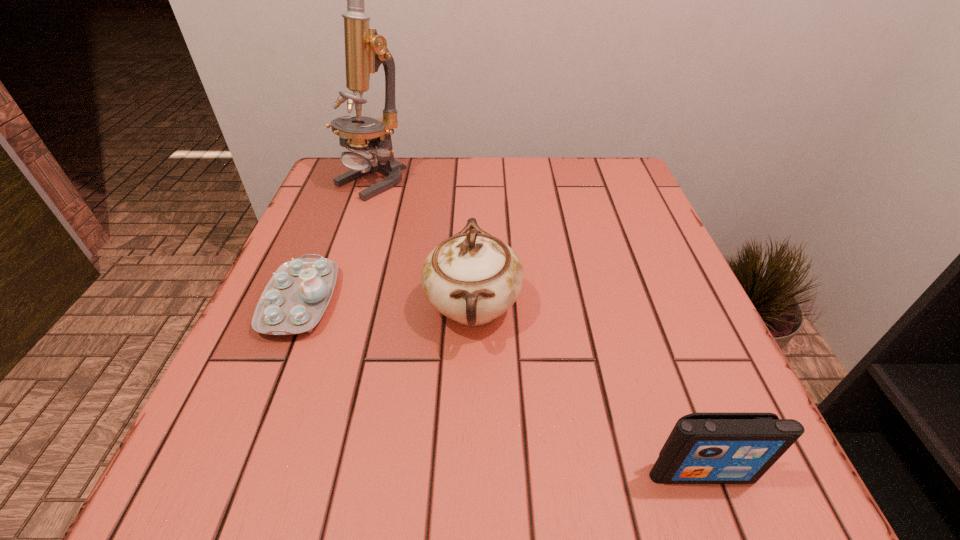
You are a GUI agent. You are given a task and a screenshot of the screen. Output one action in this format:
    pyautogui.click(x=<x>, y=<y>)
    Task: Click on the free space between the shorter chinaware and the farthest object
    
    Given the screenshot: What is the action you would take?
    pyautogui.click(x=335, y=241)

I want to click on free area in between the farthest object and the right chinaware, so click(421, 244).

This screenshot has width=960, height=540. In order to click on free spot between the second shortest object and the farthest object in this screenshot , I will do `click(536, 327)`.

Identify the location of free spot between the second shortest object and the tallest object. Image resolution: width=960 pixels, height=540 pixels. (536, 327).

In order to click on the second closest object to the second tallest object in this screenshot , I will do `click(703, 448)`.

In order to click on the closest object relative to the third tallest object in this screenshot , I will do `click(472, 278)`.

Locate an element on the screen. Image resolution: width=960 pixels, height=540 pixels. free space that satisfies the following two spatial constraints: 1. on the front side of the left chinaware; 2. on the left side of the third object from left to right is located at coordinates (299, 307).

This screenshot has width=960, height=540. What are the coordinates of `free point that satisfies the following two spatial constraints: 1. on the front side of the left chinaware; 2. on the right side of the right chinaware` in the screenshot? It's located at (299, 307).

Identify the location of vacant space that satisfies the following two spatial constraints: 1. on the front side of the shortest object; 2. on the right side of the right chinaware. This screenshot has width=960, height=540. (299, 307).